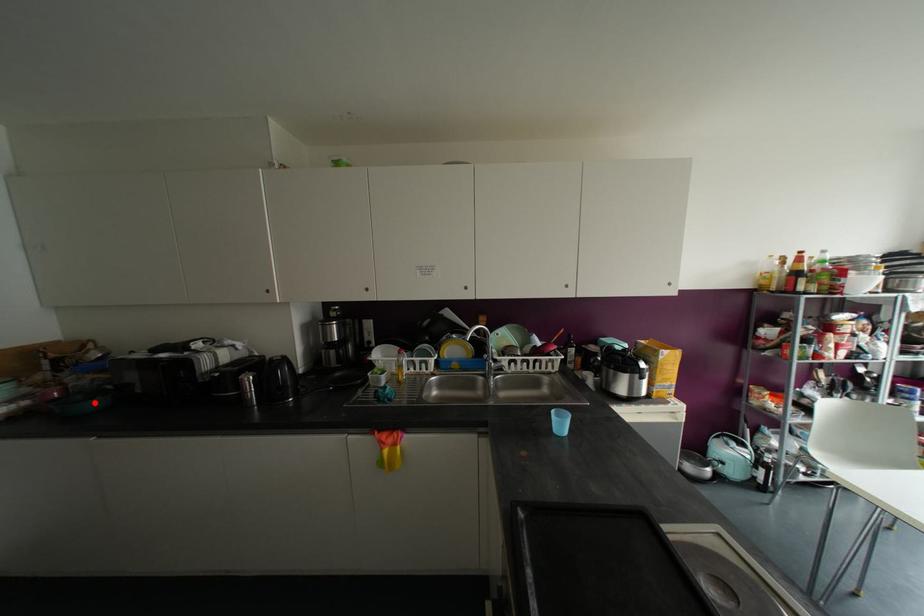
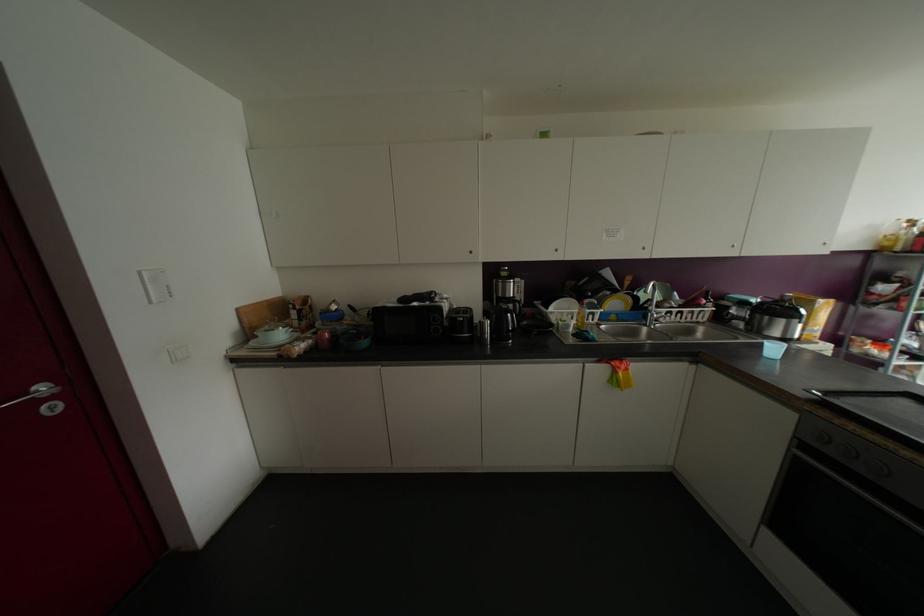
Find the pixel in the second image that matches the highlighted location in the first image.

(363, 342)